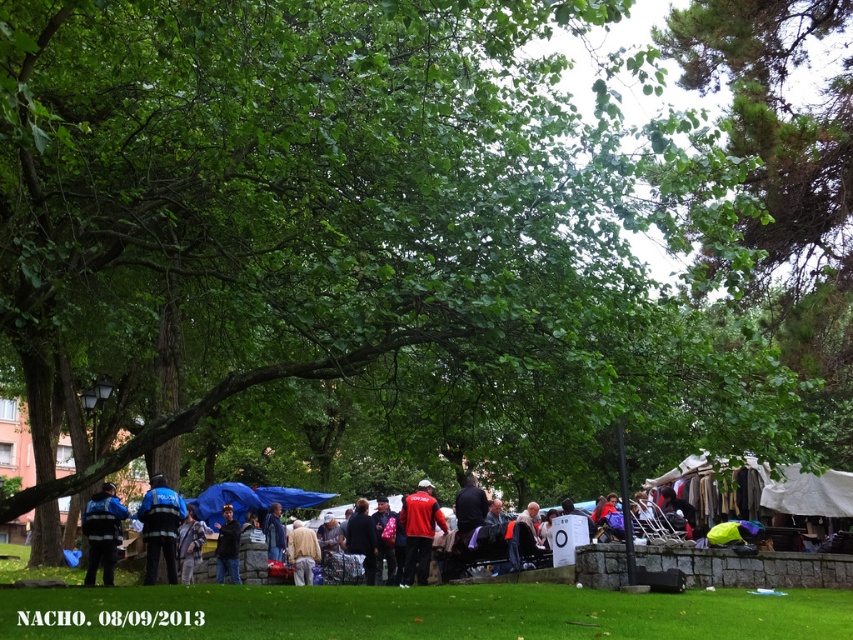
Is point (149, 529) behind point (405, 541)?

No, it is in front of (405, 541).

Is reflective blue uniform at center positioned behind red fabric jacket at center?

No.

Describe the element at coordinates (160, 525) in the screenshot. I see `reflective blue uniform at center` at that location.

At what (x,y) coordinates should I click in order to perform the action: click on reflective blue uniform at center. Please return your answer as a coordinate pair (x, y). The height and width of the screenshot is (640, 853). Looking at the image, I should click on click(x=160, y=525).

I want to click on blue uniformed officer at center, so click(102, 531).

Is point (102, 563) farther from camera compared to point (297, 580)?

No, (102, 563) is in front of (297, 580).

You are a GUI agent. You are given a task and a screenshot of the screen. Output one action in this format:
    pyautogui.click(x=<x>, y=<y>)
    Task: Click on the blue uniformed officer at center
    The width and height of the screenshot is (853, 640).
    Given the screenshot: What is the action you would take?
    pyautogui.click(x=102, y=531)

Measure the distance from reflective blue uniform at center to light beige fabric at center.

They are 9.08 feet apart.

Is point (149, 540) less distant than point (299, 538)?

Yes, point (149, 540) is in front of point (299, 538).

You are a GUI agent. You are given a task and a screenshot of the screen. Output one action in this format:
    pyautogui.click(x=<x>, y=<y>)
    Task: Click on the reflective blue uniform at center
    Image resolution: width=853 pixels, height=640 pixels.
    Given the screenshot: What is the action you would take?
    pyautogui.click(x=160, y=525)